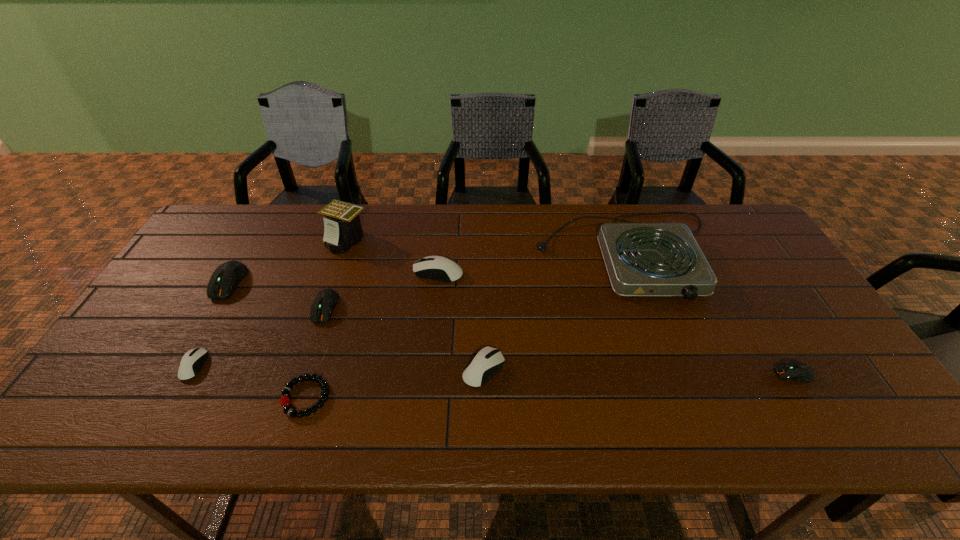
The width and height of the screenshot is (960, 540). In order to click on the third closest computer equipment to the second dark computer equipment from right to left in this screenshot , I will do [x=192, y=361].

Identify which white mouse is located as the third nearest to the tallest object. Please provide its 2D coordinates. Your answer should be formatted as a tuple, i.e. [(x, y)], where the tuple contains the x and y coordinates of a point satisfying the conditions above.

[(488, 361)]

Where is `the second closest white mouse to the tallest object`? the second closest white mouse to the tallest object is located at coordinates (192, 361).

The height and width of the screenshot is (540, 960). Find the location of `the second closest dark computer equipment to the tallest object`. the second closest dark computer equipment to the tallest object is located at coordinates (224, 280).

Where is `the closest dark computer equipment to the eighth shortest object`? Image resolution: width=960 pixels, height=540 pixels. the closest dark computer equipment to the eighth shortest object is located at coordinates (798, 371).

Find the location of `blank space that satisfies the following two spatial constraints: 1. on the button of the smallest white mouse; 2. on the left side of the biggest dark computer equipment`. blank space that satisfies the following two spatial constraints: 1. on the button of the smallest white mouse; 2. on the left side of the biggest dark computer equipment is located at coordinates (180, 366).

Locate an element on the screen. This screenshot has height=540, width=960. free space that satisfies the following two spatial constraints: 1. on the back side of the third object from right to left; 2. on the left side of the bracelet is located at coordinates (314, 369).

Locate an element on the screen. The image size is (960, 540). free space that satisfies the following two spatial constraints: 1. on the back side of the black bracelet; 2. on the right side of the seventh object from left to right is located at coordinates (314, 369).

You are a GUI agent. You are given a task and a screenshot of the screen. Output one action in this format:
    pyautogui.click(x=<x>, y=<y>)
    Task: Click on the vacant space that satisfies the following two spatial constraints: 1. on the front side of the bracelet; 2. on the right side of the calculator
    
    Given the screenshot: What is the action you would take?
    pyautogui.click(x=294, y=397)

Where is `blank space that satisfies the following two spatial constraints: 1. on the front side of the calculator; 2. on the left side of the shortest object`? blank space that satisfies the following two spatial constraints: 1. on the front side of the calculator; 2. on the left side of the shortest object is located at coordinates pyautogui.click(x=294, y=397).